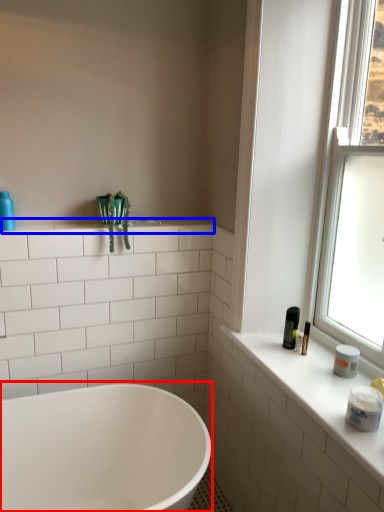
Question: Which point is closer to the camera, bathtub (highlighted by a red box) or window sill (highlighted by a blue box)?

Choices:
 (A) bathtub
 (B) window sill

Answer: (A)